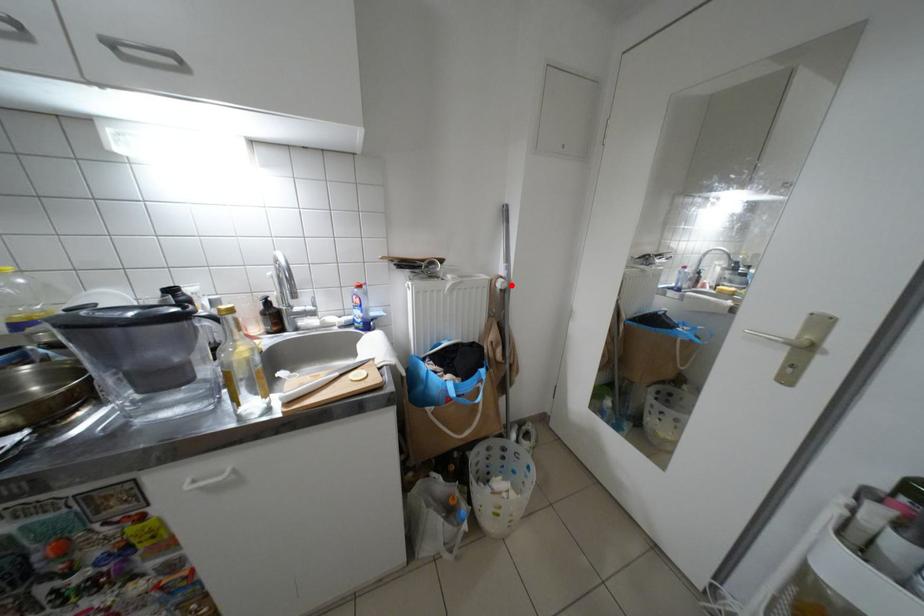
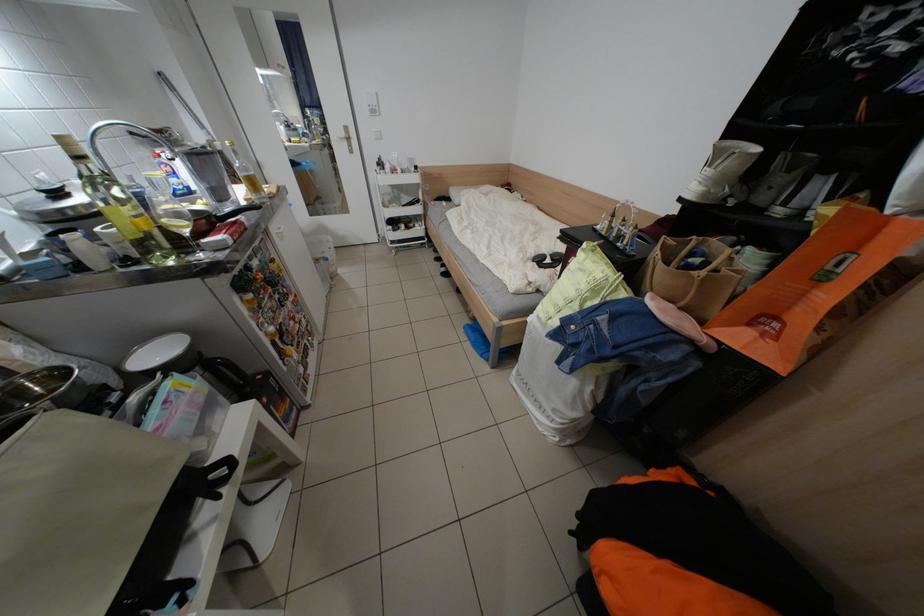
Question: I am providing you with two images of the same scene from different viewpoints. Given a red point in image1, look at the same physical point in image2. Is it:

Choices:
 (A) Closer to the viewpoint
 (B) Farther from the viewpoint

Answer: (B)